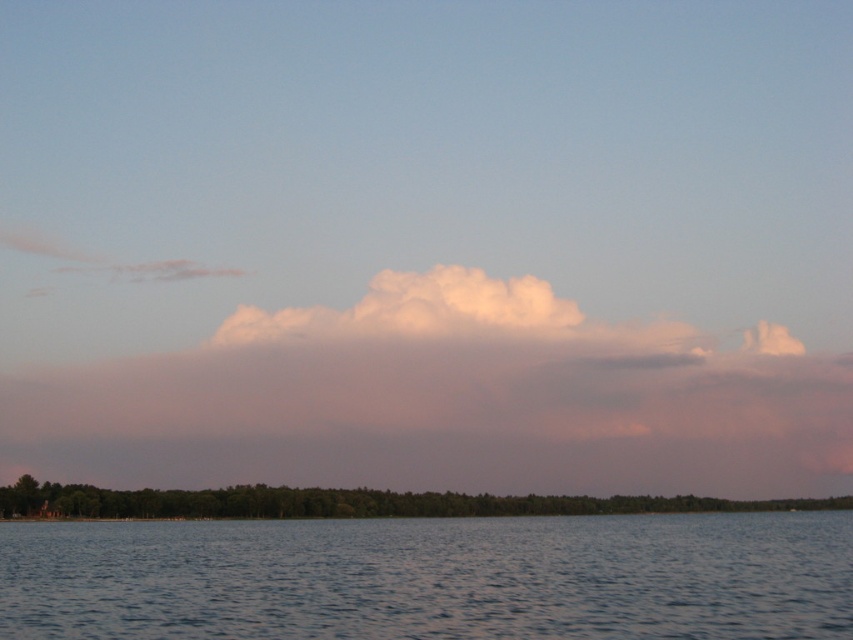
You are standing at the edge of the water and want to take a photo of the white fluffy cloud at center and the clear water at lower center. Which object is located to the right when you look towards the water?

The white fluffy cloud at center is positioned on the right side of clear water at lower center, so when looking towards the water, the white fluffy cloud at center is to the right of the clear water at lower center.

You are standing at the edge of the water and want to know which object in the scene is larger. Based on the clear water at lower center and the green leafy trees at lower center, which one occupies more space in the image?

The clear water at lower center is bigger than the green leafy trees at lower center, so it occupies more space in the image.

You are standing at the edge of the water in the scene. Looking towards the horizon, you see the clear water at lower center and the green leafy trees at lower center. Which object is closer to you?

The clear water at lower center is closer to you because it is located above the green leafy trees at lower center, meaning the trees are further away in the background.